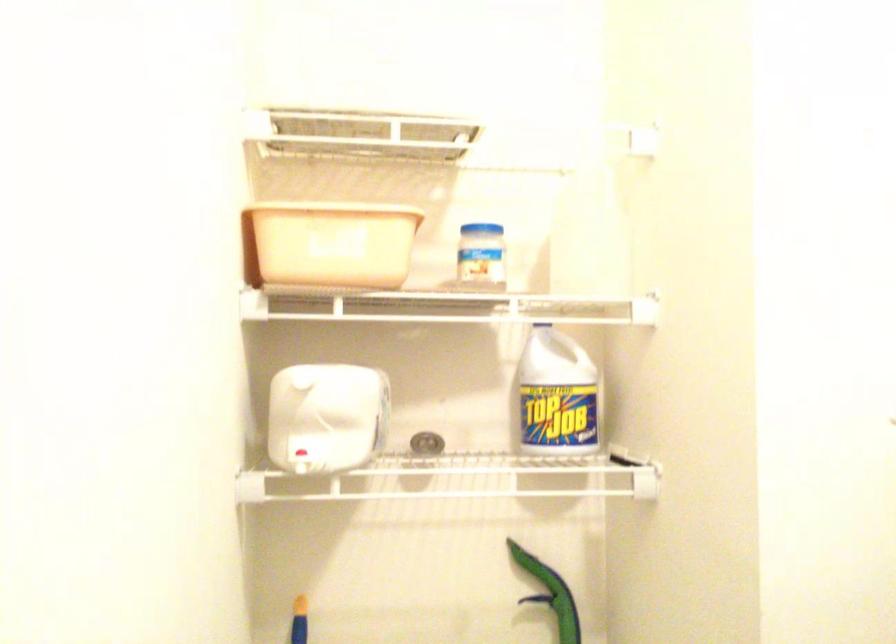
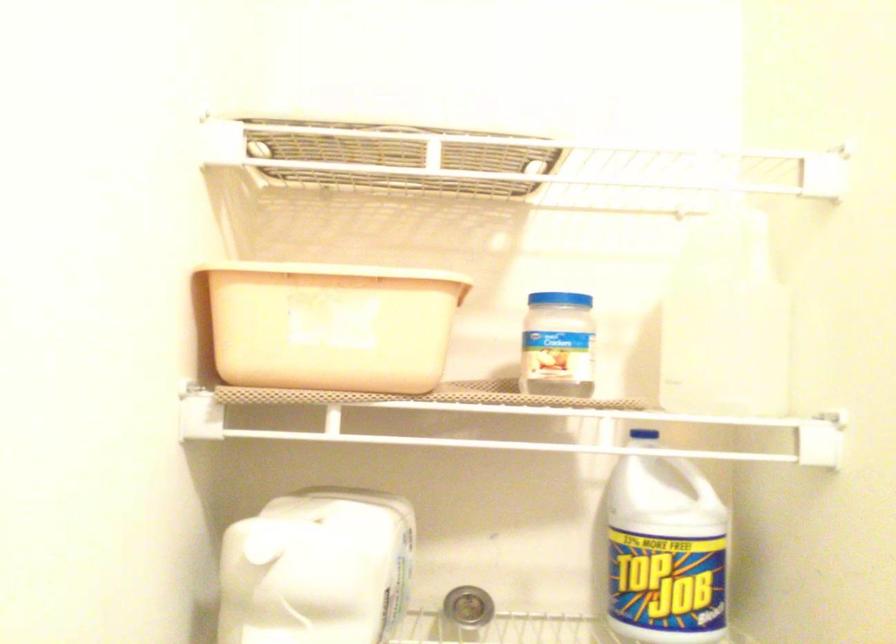
Where in the second image is the point corresponding to the point at 547,322 from the first image?

(650, 435)